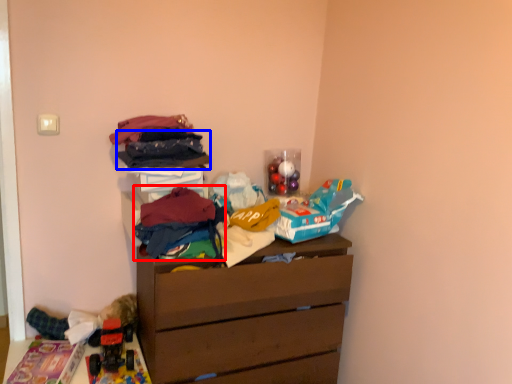
Question: Which object appears closest to the camera in this image, clothing (highlighted by a red box) or clothing (highlighted by a blue box)?

Choices:
 (A) clothing
 (B) clothing

Answer: (A)